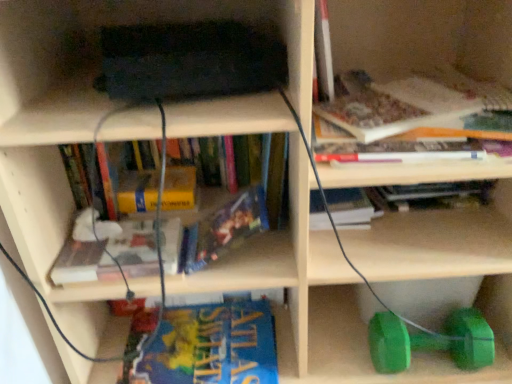
Question: In terms of width, does blue glossy book at lower center, positioned as the 1th book in bottom-to-top order, look wider or thinner when compared to hardcover book at center, the fifth book from the top?

Choices:
 (A) wide
 (B) thin

Answer: (A)

Question: From the image's perspective, relative to hardcover book at center, the fourth book in the bottom-to-top sequence, is blue glossy book at lower center, positioned as the 1th book in bottom-to-top order, above or below?

Choices:
 (A) above
 (B) below

Answer: (B)

Question: Considering the real-world distances, which object is closest to the yellow paperback book at center, which appears as the 5th book when ordered from the bottom?

Choices:
 (A) blue glossy book at lower center, positioned as the 1th book in bottom-to-top order
 (B) hardcover book at upper right, which is the eighth book from bottom to top
 (C) hardcover book at upper right, which is the seventh book in bottom-to-top order
 (D) blue matte book at center, positioned as the 7th book in top-to-bottom order
 (E) hardcover book at center, the 6th book positioned from the top

Answer: (E)

Question: Which object is the closest to the hardcover book at upper center, the third book when ordered from top to bottom?

Choices:
 (A) hardcover book at center, the fifth book from the top
 (B) green rubber dumbbell at lower right
 (C) blue glossy book at lower center, the 8th book in the top-to-bottom sequence
 (D) hardcover book at upper right, acting as the first book starting from the top
 (E) hardcover book at upper right, which is the seventh book in bottom-to-top order

Answer: (E)